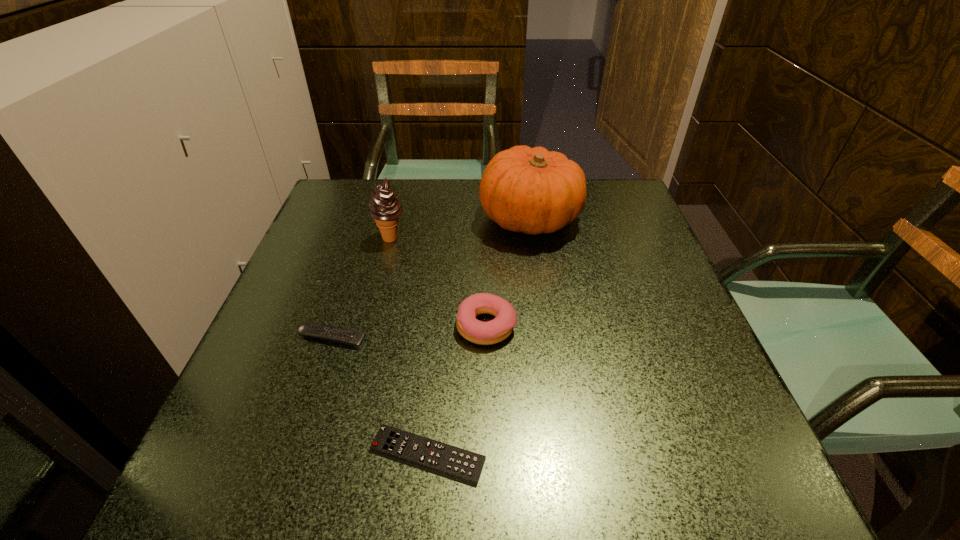
You are a GUI agent. You are given a task and a screenshot of the screen. Output one action in this format:
    pyautogui.click(x=<x>, y=<y>)
    Task: Click on the vacant area that lies between the doughnut and the shortest object
    Image resolution: width=960 pixels, height=540 pixels.
    Given the screenshot: What is the action you would take?
    (457, 390)

Where is `free space between the farther remote control and the shorter remote control`? The image size is (960, 540). free space between the farther remote control and the shorter remote control is located at coordinates (380, 396).

The height and width of the screenshot is (540, 960). Find the location of `unoccupied area between the pumpkin and the third shortest object`. unoccupied area between the pumpkin and the third shortest object is located at coordinates (508, 272).

At what (x,y) coordinates should I click in order to perform the action: click on vacant space in between the third tallest object and the pumpkin. Please return your answer as a coordinate pair (x, y). This screenshot has height=540, width=960. Looking at the image, I should click on (508, 272).

I want to click on unoccupied position between the icecream and the pumpkin, so click(x=461, y=228).

Find the location of a particular element. Image resolution: width=960 pixels, height=540 pixels. the third closest object to the pumpkin is located at coordinates point(353,338).

Point out which object is positioned as the fourth nearest to the pumpkin. Please provide its 2D coordinates. Your answer should be formatted as a tuple, i.e. [(x, y)], where the tuple contains the x and y coordinates of a point satisfying the conditions above.

[(443, 458)]

Where is `vacant space that satisfies the following two spatial constraints: 1. on the back side of the pumpkin; 2. on the right side of the nearest object`? The height and width of the screenshot is (540, 960). vacant space that satisfies the following two spatial constraints: 1. on the back side of the pumpkin; 2. on the right side of the nearest object is located at coordinates (449, 219).

Identify the location of free location that satisfies the following two spatial constraints: 1. on the front side of the farther remote control; 2. on the right side of the shorter remote control. The height and width of the screenshot is (540, 960). (295, 455).

Where is `free space in the image that satisfies the following two spatial constraints: 1. on the back side of the pumpkin; 2. on the left side of the icecream`? free space in the image that satisfies the following two spatial constraints: 1. on the back side of the pumpkin; 2. on the left side of the icecream is located at coordinates (396, 219).